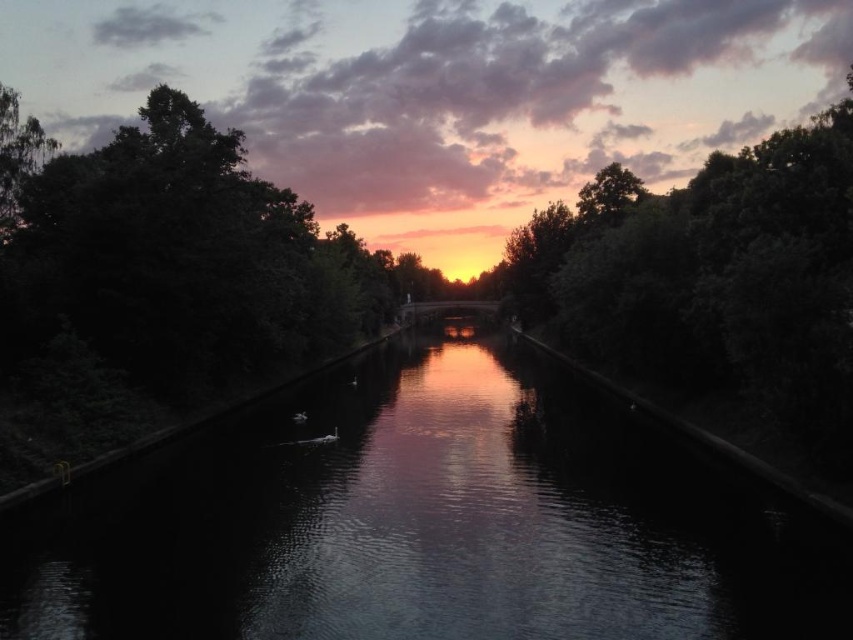
You are standing at the edge of the canal and want to find the dark reflective water at center. According to the coordinates provided, in which direction should you look relative to your position?

The dark reflective water at center is located at coordinates point (421, 522), which would be in the center of the image. Therefore, you should look straight ahead to find it.

You are an architect designing a new building that needs to preserve the view of both the green leafy tree at upper center and the green leafy tree at upper left from the main window. Which tree should you consider in terms of height when planning the building height to ensure both are visible?

The green leafy tree at upper center is much taller than the green leafy tree at upper left. To ensure both are visible, the building height should be planned considering the height of the taller tree, the green leafy tree at upper center.

You are standing on the bank of the canal and want to take a photo of the green leafy tree at upper left. However, you notice the dark reflective water at center is blocking your view. Can you adjust your position to capture the tree without the water obstructing it?

The dark reflective water at center is in front of the green leafy tree at upper left, so moving your position to the side or behind the water might allow you to capture the tree without obstruction.